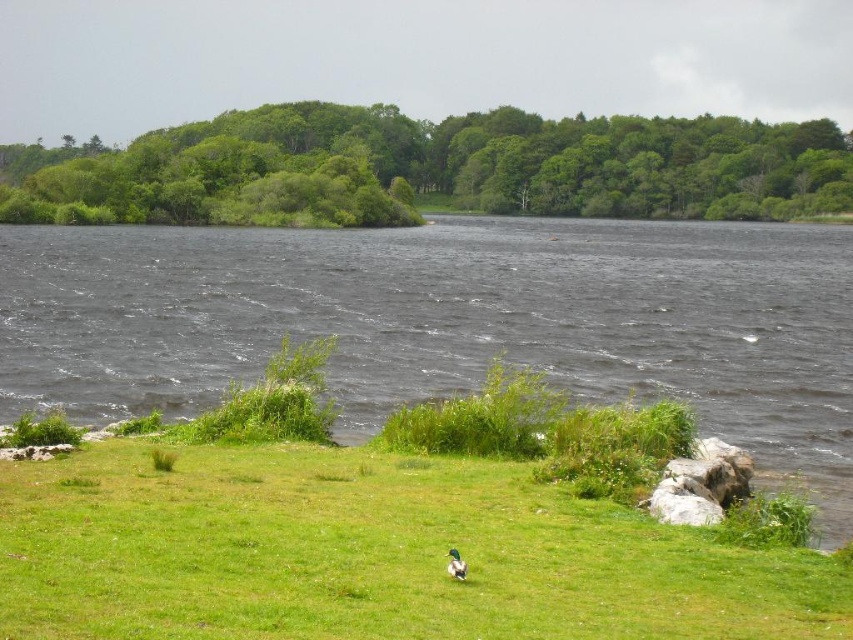
Question: Which object is closer to the camera taking this photo?

Choices:
 (A) dark water at center
 (B) green grassy at lower center
 (C) gray rock at lower right

Answer: (B)

Question: Observing the image, what is the correct spatial positioning of dark water at center in reference to green grassy at lower center?

Choices:
 (A) above
 (B) below

Answer: (A)

Question: Does green leafy trees at upper center have a lesser width compared to green glossy duck at center?

Choices:
 (A) no
 (B) yes

Answer: (A)

Question: Which object is farther from the camera taking this photo?

Choices:
 (A) green grassy at lower center
 (B) dark water at center

Answer: (B)

Question: Does green grassy at lower center have a smaller size compared to green leafy trees at upper center?

Choices:
 (A) yes
 (B) no

Answer: (A)

Question: Which object is the closest to the green glossy duck at center?

Choices:
 (A) gray rock at lower right
 (B) green leafy trees at upper center
 (C) green grassy at lower center
 (D) dark water at center

Answer: (C)